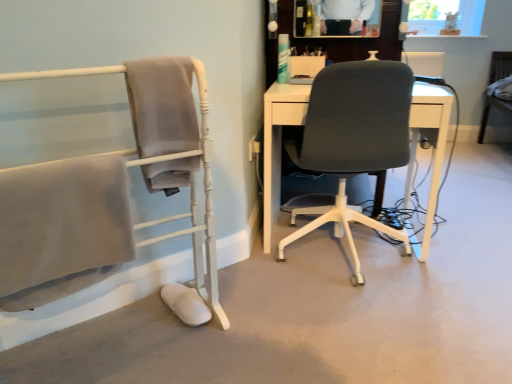
Locate an element on the screen. This screenshot has width=512, height=384. empty space that is in between dark gray fabric office chair at center, which is the second chair in front-to-back order, and matte gray chair at left, positioned as the third chair in back-to-front order is located at coordinates (260, 306).